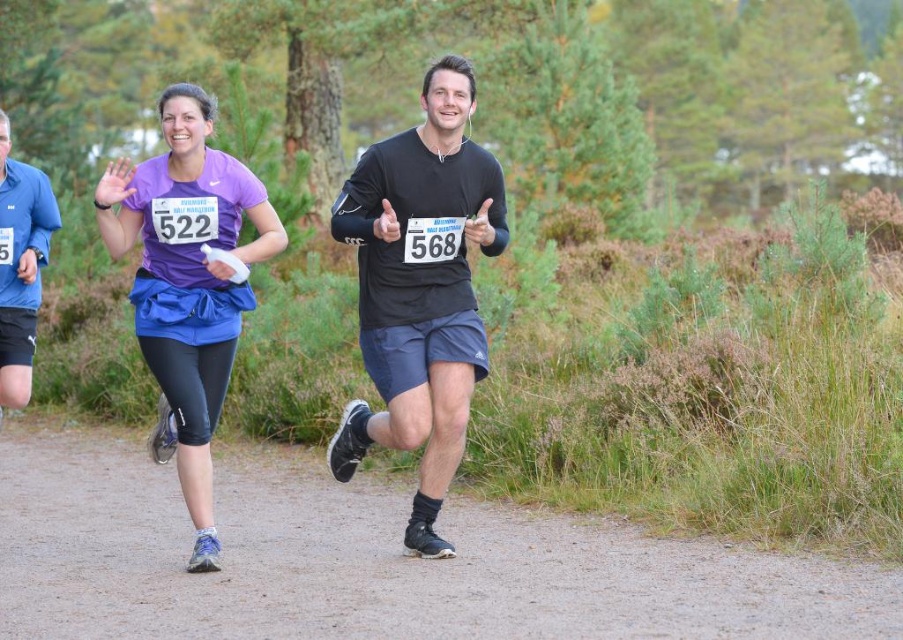
Question: Which point is farther from the camera taking this photo?

Choices:
 (A) (435, 232)
 (B) (24, 401)
 (C) (211, 170)
 (D) (365, 513)

Answer: (D)

Question: Which of these objects is positioned farthest from the dirt trail at center?

Choices:
 (A) black matte running shoe at center
 (B) purple matte shirt at center

Answer: (B)

Question: Is dirt trail at center smaller than purple matte shirt at center?

Choices:
 (A) yes
 (B) no

Answer: (A)

Question: Is dirt trail at center bigger than black matte running shoe at center?

Choices:
 (A) yes
 (B) no

Answer: (B)

Question: Can you confirm if black matte running shoe at center is smaller than blue fabric shirt at left?

Choices:
 (A) yes
 (B) no

Answer: (B)

Question: Which point is farther to the camera?

Choices:
 (A) click(712, 618)
 (B) click(453, 64)
 (C) click(116, 250)

Answer: (B)